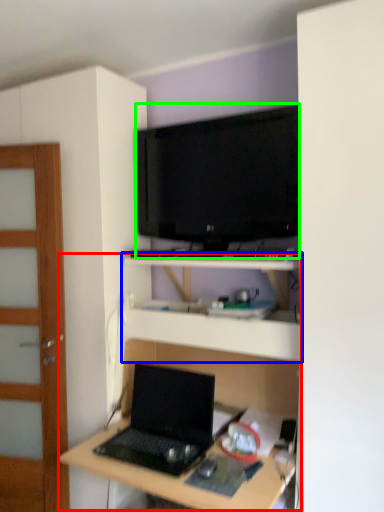
Question: Based on their relative distances, which object is nearer to computer desk (highlighted by a red box)? Choose from shelf (highlighted by a blue box) and television (highlighted by a green box).

Choices:
 (A) shelf
 (B) television

Answer: (A)